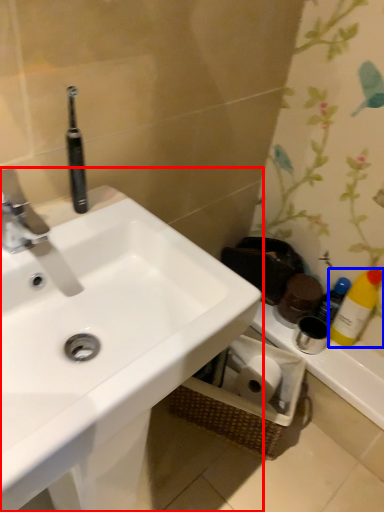
Question: Which point is closer to the camera, sink (highlighted by a red box) or cleaning product (highlighted by a blue box)?

Choices:
 (A) sink
 (B) cleaning product

Answer: (A)